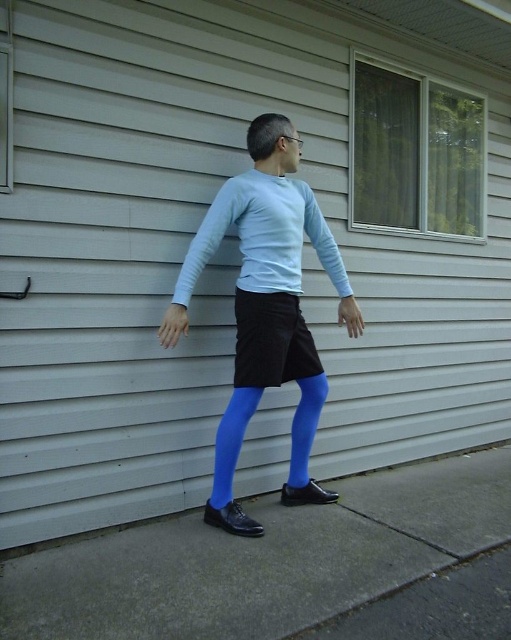
Question: Is light blue matte long-sleeve shirt at center smaller than blue tights at lower center?

Choices:
 (A) yes
 (B) no

Answer: (B)

Question: Which of the following is the closest to the observer?

Choices:
 (A) (295, 356)
 (B) (262, 246)
 (C) (305, 474)

Answer: (B)

Question: Does smooth concrete pavement at lower center appear on the right side of blue tights at center?

Choices:
 (A) no
 (B) yes

Answer: (B)

Question: Is light blue matte long-sleeve shirt at center thinner than blue matte tights at center?

Choices:
 (A) yes
 (B) no

Answer: (B)

Question: Which point appears closest to the camera in this image?

Choices:
 (A) (295, 499)
 (B) (303, 417)
 (C) (304, 220)

Answer: (C)

Question: Among these points, which one is nearest to the camera?

Choices:
 (A) (235, 397)
 (B) (266, 220)
 (C) (44, 602)
 (D) (276, 268)

Answer: (C)